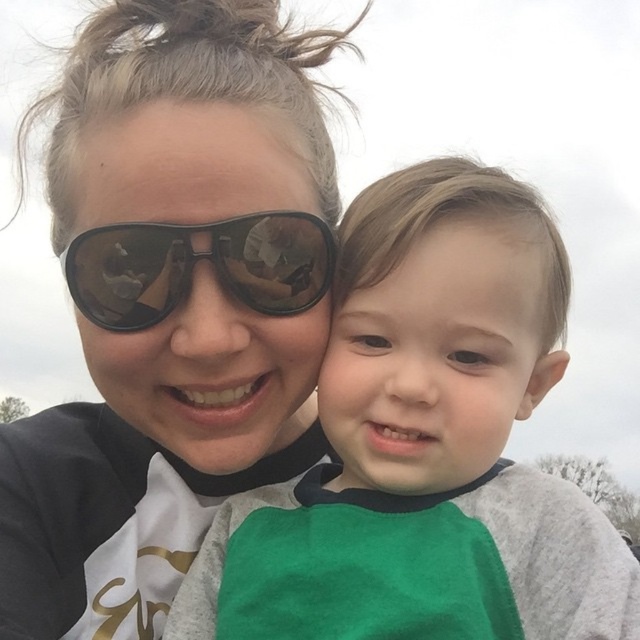
Who is positioned more to the right, matte black sunglasses at upper center or green fabric face at center?

From the viewer's perspective, green fabric face at center appears more on the right side.

Can you confirm if matte black sunglasses at upper center is positioned above green fabric face at center?

Yes.

At what (x,y) coordinates should I click in order to perform the action: click on matte black sunglasses at upper center. Please return your answer as a coordinate pair (x, y). Looking at the image, I should click on (212, 374).

Locate an element on the screen. matte black sunglasses at upper center is located at coordinates (212, 374).

Can you confirm if matte black sunglasses at upper left is positioned below green fabric face at center?

No, matte black sunglasses at upper left is not below green fabric face at center.

Is matte black sunglasses at upper left bigger than green fabric face at center?

Correct, matte black sunglasses at upper left is larger in size than green fabric face at center.

Where is `matte black sunglasses at upper left`? The height and width of the screenshot is (640, 640). matte black sunglasses at upper left is located at coordinates (170, 307).

The height and width of the screenshot is (640, 640). In order to click on matte black sunglasses at upper left in this screenshot , I will do `click(170, 307)`.

Which of these two, matte black sunglasses at upper left or green fabric shirt at center, stands taller?

matte black sunglasses at upper left

How distant is matte black sunglasses at upper left from green fabric shirt at center?

13.05 inches

At what (x,y) coordinates should I click in order to perform the action: click on matte black sunglasses at upper left. Please return your answer as a coordinate pair (x, y). Looking at the image, I should click on (170, 307).